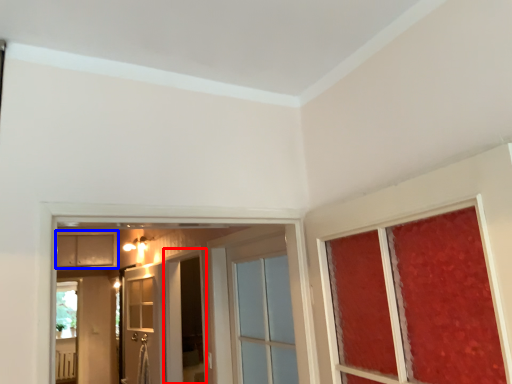
Question: Which object appears farthest to the camera in this image, screen door (highlighted by a red box) or cabinetry (highlighted by a blue box)?

Choices:
 (A) screen door
 (B) cabinetry

Answer: (B)